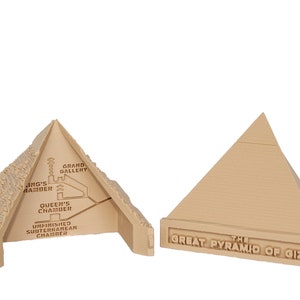
The image size is (300, 300). Identify the location of chamber. (53, 210).